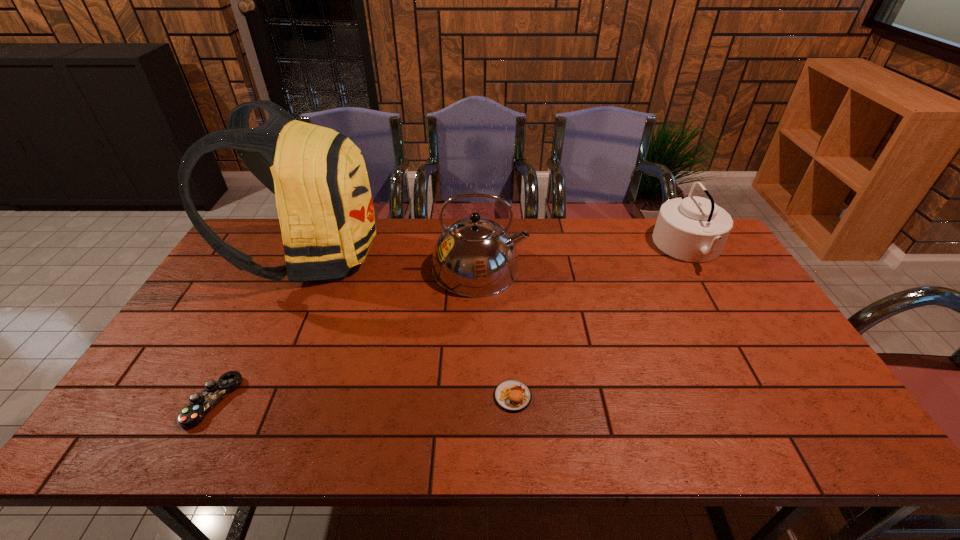
Locate an element on the screen. free space between the second tallest object and the second shortest object is located at coordinates (496, 332).

Image resolution: width=960 pixels, height=540 pixels. I want to click on free spot between the patty and the control, so click(x=363, y=399).

Find the location of a particular element. free spot between the right kettle and the fourth shortest object is located at coordinates click(585, 258).

This screenshot has height=540, width=960. I want to click on unoccupied position between the patty and the tallest object, so click(414, 326).

At what (x,y) coordinates should I click in order to perform the action: click on free area in between the patty and the tallest object. Please return your answer as a coordinate pair (x, y). Looking at the image, I should click on (414, 326).

Find the location of a particular element. Image resolution: width=960 pixels, height=540 pixels. object that is the third closest one to the backpack is located at coordinates (512, 395).

Locate an element on the screen. object that is the closest to the third tallest object is located at coordinates (474, 257).

This screenshot has width=960, height=540. I want to click on blank area in the image that satisfies the following two spatial constraints: 1. on the back side of the patty; 2. on the right side of the shortest object, so click(x=216, y=396).

This screenshot has height=540, width=960. In order to click on free region that satisfies the following two spatial constraints: 1. on the back side of the second shortest object; 2. from the spout of the taller kettle in this screenshot , I will do `click(504, 268)`.

Locate an element on the screen. The image size is (960, 540). free space that satisfies the following two spatial constraints: 1. from the spout of the fourth shortest object; 2. on the front side of the shortest object is located at coordinates (480, 401).